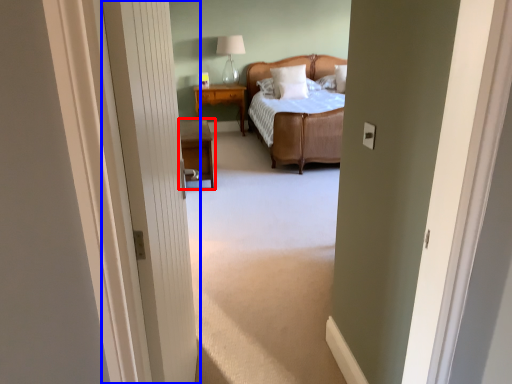
Question: Among these objects, which one is nearest to the camera, nightstand (highlighted by a red box) or door (highlighted by a blue box)?

Choices:
 (A) nightstand
 (B) door

Answer: (B)